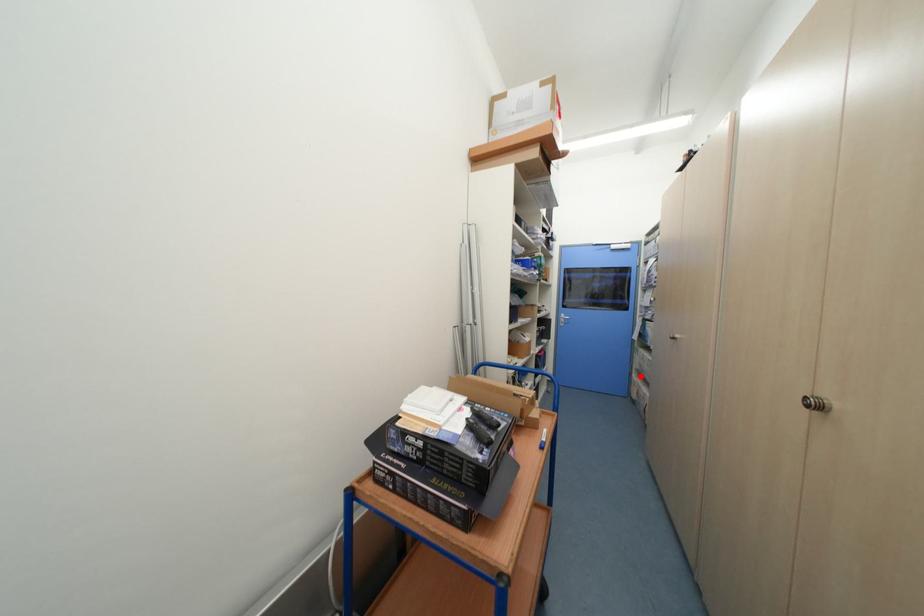
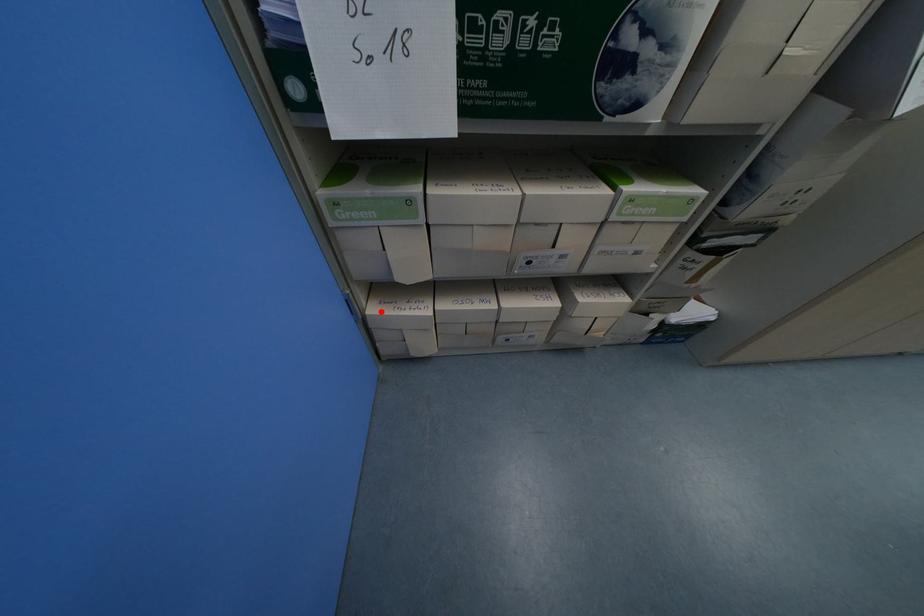
I am providing you with two images of the same scene from different viewpoints. A red point is marked on the first image and another point is marked on the second image. Is the red point in image1 aligned with the point shown in image2?

Yes